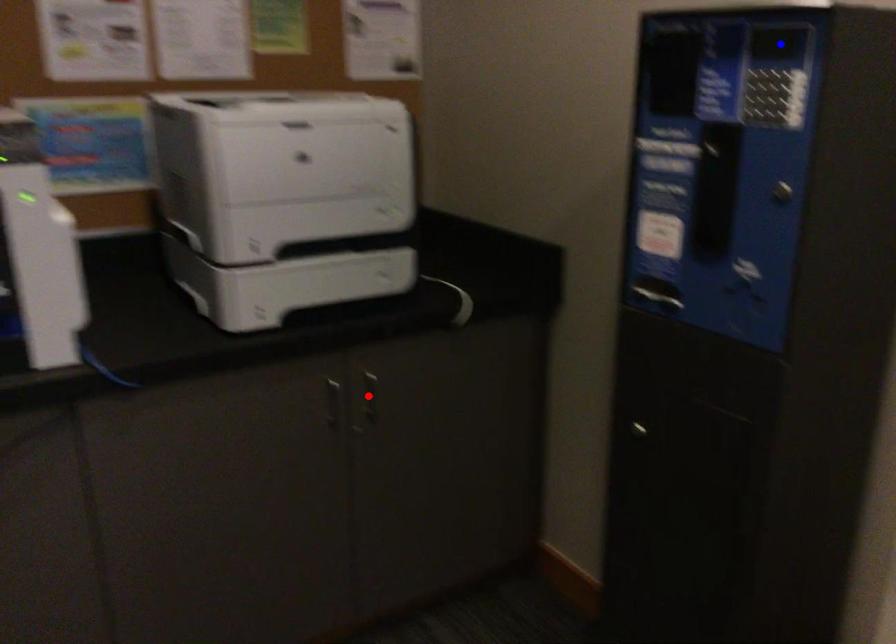
Question: In the image, two points are highlighted. Which point is nearer to the camera? Reply with the corresponding letter.

Choices:
 (A) blue point
 (B) red point

Answer: (A)